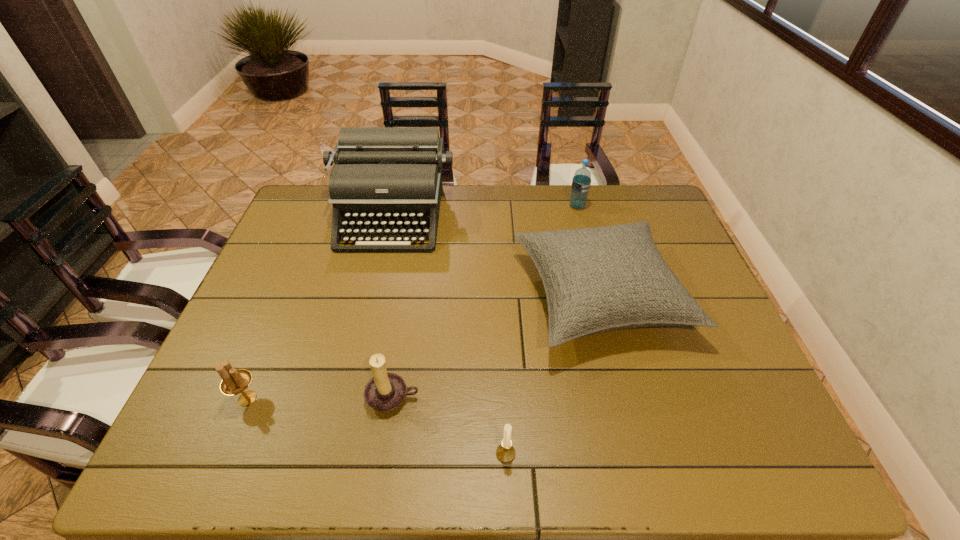
Where is `free space located on the wick of the second candle holder from right to left`? The width and height of the screenshot is (960, 540). free space located on the wick of the second candle holder from right to left is located at coordinates (386, 442).

You are a GUI agent. You are given a task and a screenshot of the screen. Output one action in this format:
    pyautogui.click(x=<x>, y=<y>)
    Task: Click on the vacant region located on the right of the leftmost candle holder
    The image size is (960, 540).
    Given the screenshot: What is the action you would take?
    pyautogui.click(x=310, y=399)

Locate an element on the screen. This screenshot has width=960, height=540. blank space located on the left of the nearest candle holder is located at coordinates (415, 454).

The image size is (960, 540). Identify the location of typewriter at the far edge. coord(386,180).

Where is `water bottle present at the far edge`? This screenshot has width=960, height=540. water bottle present at the far edge is located at coordinates (581, 182).

Locate an element on the screen. object present at the near edge is located at coordinates (505, 452).

I want to click on typewriter present at the left edge, so click(x=386, y=180).

Where is `candle holder at the left edge`? The height and width of the screenshot is (540, 960). candle holder at the left edge is located at coordinates point(234,381).

The width and height of the screenshot is (960, 540). In order to click on object situated at the right edge in this screenshot , I will do tap(598, 279).

Where is `object located in the far left corner section of the desktop`? object located in the far left corner section of the desktop is located at coordinates 386,180.